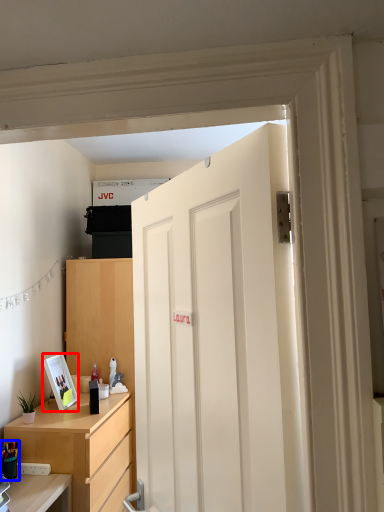
Question: Among these objects, which one is nearest to the camera, picture frame (highlighted by a red box) or stationery (highlighted by a blue box)?

Choices:
 (A) picture frame
 (B) stationery

Answer: (B)